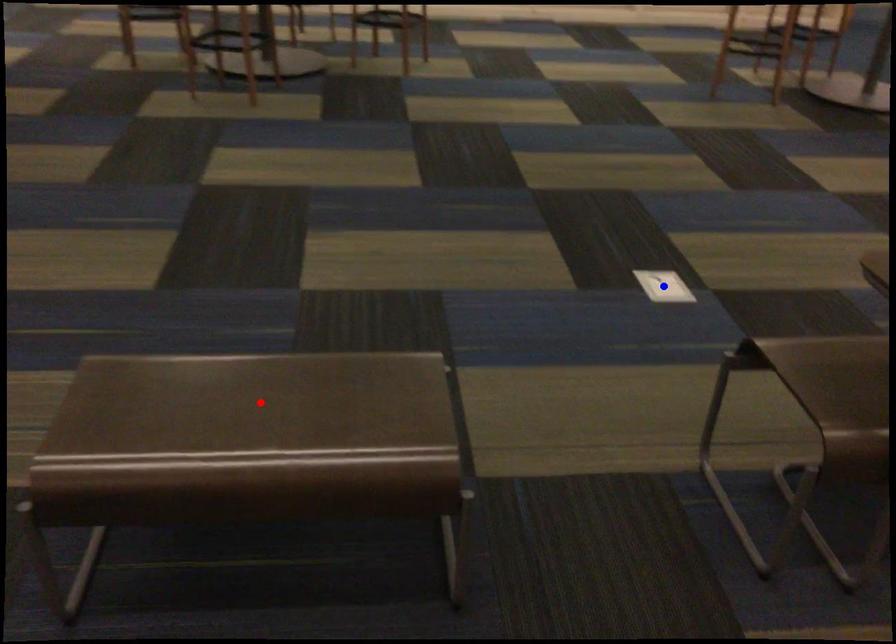
Question: Two points are marked on the image. Which point is closer to the camera?

Choices:
 (A) Blue point is closer.
 (B) Red point is closer.

Answer: (B)